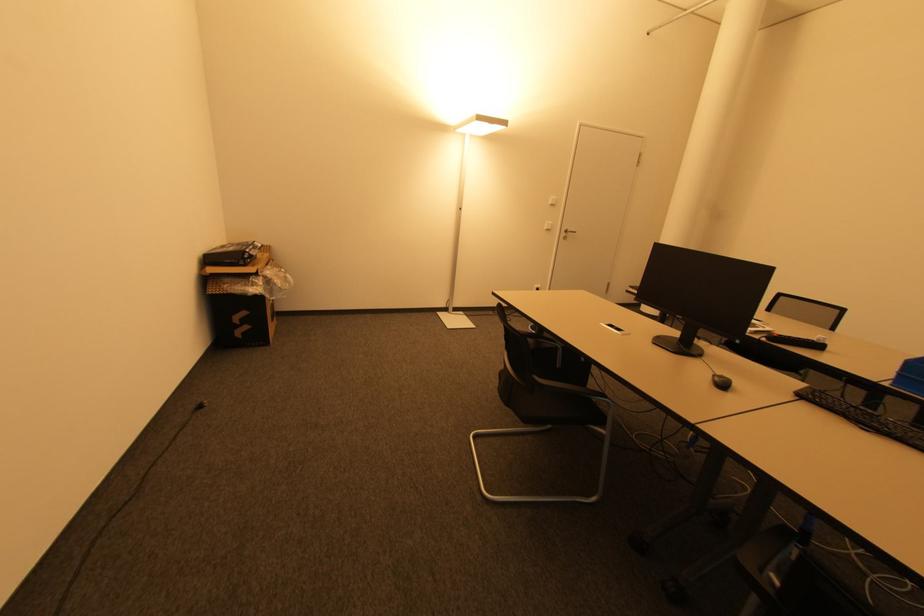
Where would you click the black computer mouse? Please return your answer as a coordinate pair (x, y).

(721, 382)